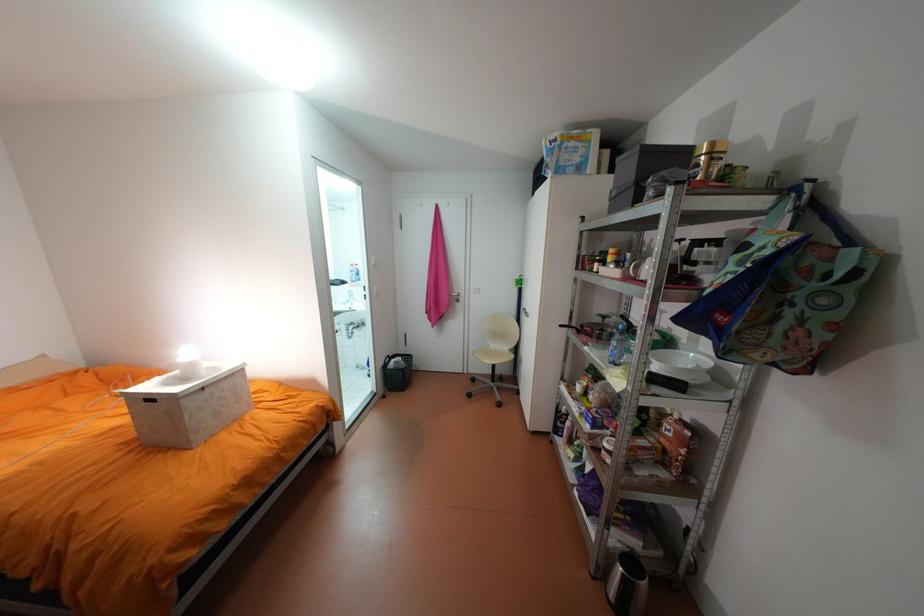
Find where to lift the small white lamp. Please return your answer as a coordinate pair (x, y).

(188, 362)